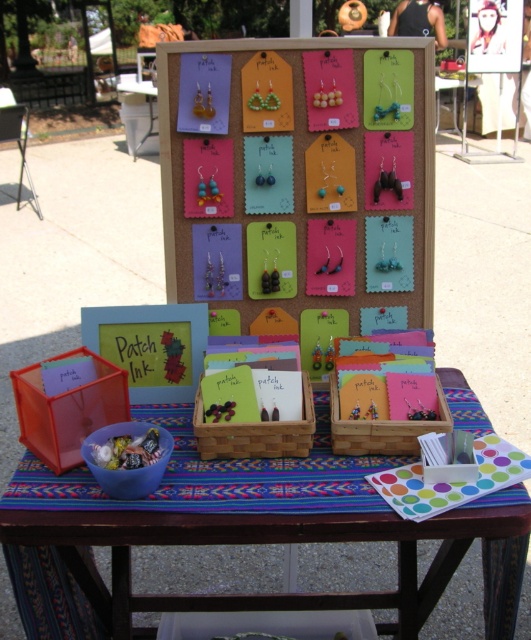
Question: Is translucent plastic candy container at lower left to the left of black matte tank top at upper center from the viewer's perspective?

Choices:
 (A) no
 (B) yes

Answer: (B)

Question: Among these points, which one is nearest to the camera?

Choices:
 (A) (230, 605)
 (B) (390, 20)

Answer: (A)

Question: Which of the following is the farthest from the observer?

Choices:
 (A) black matte tank top at upper center
 (B) translucent plastic candy container at lower left

Answer: (A)

Question: Does translucent plastic candy container at lower left appear on the right side of black matte tank top at upper center?

Choices:
 (A) yes
 (B) no

Answer: (B)

Question: Does translucent plastic candy container at lower left come behind black matte tank top at upper center?

Choices:
 (A) yes
 (B) no

Answer: (B)